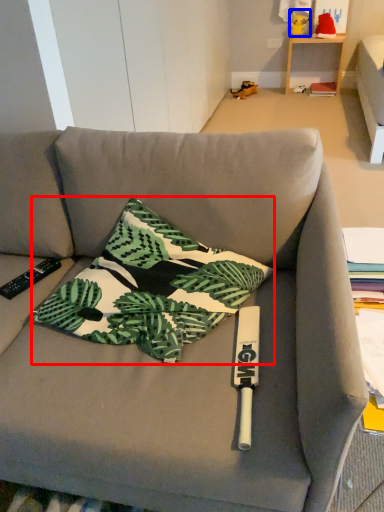
Question: Which of the following is the farthest to the observer, pillow (highlighted by a red box) or toy (highlighted by a blue box)?

Choices:
 (A) pillow
 (B) toy

Answer: (B)